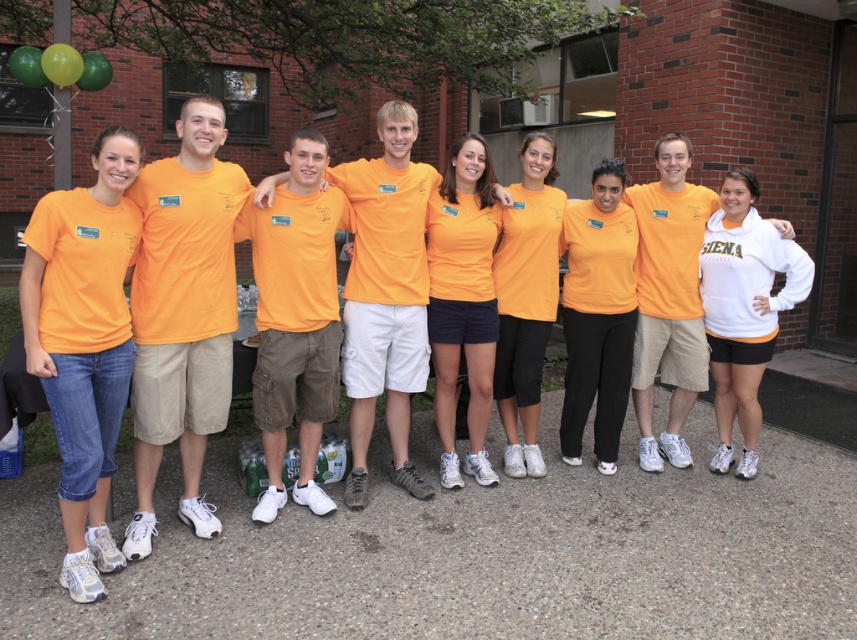
Is point (93, 236) more distant than point (480, 381)?

No, (93, 236) is closer to viewer.

From the picture: Between matte orange t-shirt at left and orange matte shorts at center, which one appears on the left side from the viewer's perspective?

matte orange t-shirt at left

Is point (43, 374) positioned behind point (478, 218)?

No, (43, 374) is closer to viewer.

You are a GUI agent. You are given a task and a screenshot of the screen. Output one action in this format:
    pyautogui.click(x=<x>, y=<y>)
    Task: Click on the matte orange t-shirt at left
    
    Given the screenshot: What is the action you would take?
    pyautogui.click(x=84, y=342)

Can you confirm if matte orange t-shirt at left is positioned to the left of orange matte shirt at center?

Correct, you'll find matte orange t-shirt at left to the left of orange matte shirt at center.

Describe the element at coordinates (84, 342) in the screenshot. I see `matte orange t-shirt at left` at that location.

Where is `matte orange t-shirt at left`? The image size is (857, 640). matte orange t-shirt at left is located at coordinates [84, 342].

Who is lower down, orange matte shorts at center or orange matte shirt at center?

Positioned lower is orange matte shorts at center.

Does orange matte shorts at center appear on the right side of orange matte shirt at center?

No, orange matte shorts at center is not to the right of orange matte shirt at center.

Between point (452, 177) and point (556, 218), which one is positioned behind?

The point (556, 218) is more distant.

Where is `orange matte shorts at center`? orange matte shorts at center is located at coordinates (463, 300).